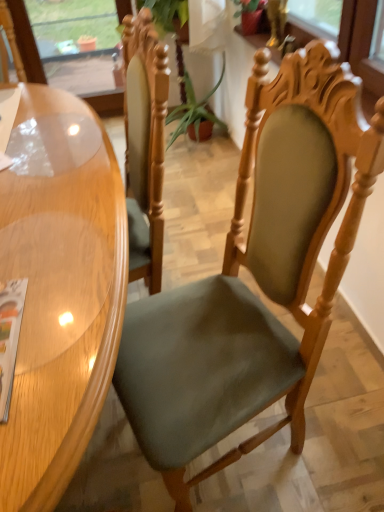
Question: Considering the relative sizes of green fabric plant at center and matte paper magazine at lower left in the image provided, is green fabric plant at center taller than matte paper magazine at lower left?

Choices:
 (A) yes
 (B) no

Answer: (A)

Question: From the image's perspective, is green fabric plant at center located beneath matte paper magazine at lower left?

Choices:
 (A) yes
 (B) no

Answer: (B)

Question: From the image's perspective, is green fabric plant at center located above matte paper magazine at lower left?

Choices:
 (A) no
 (B) yes

Answer: (B)

Question: Is green fabric plant at center closer to camera compared to matte paper magazine at lower left?

Choices:
 (A) yes
 (B) no

Answer: (B)

Question: Can you confirm if green fabric plant at center is positioned to the right of matte paper magazine at lower left?

Choices:
 (A) no
 (B) yes

Answer: (B)

Question: Is point (193, 131) closer or farther from the camera than point (331, 80)?

Choices:
 (A) closer
 (B) farther

Answer: (B)

Question: From their relative heights in the image, would you say green fabric plant at center is taller or shorter than suede green chair at center?

Choices:
 (A) tall
 (B) short

Answer: (B)

Question: In the image, is green fabric plant at center on the left side or the right side of suede green chair at center?

Choices:
 (A) right
 (B) left

Answer: (B)

Question: From a real-world perspective, relative to suede green chair at center, is green fabric plant at center vertically above or below?

Choices:
 (A) below
 (B) above

Answer: (A)

Question: From their relative heights in the image, would you say suede green chair at center is taller or shorter than green fabric plant at center?

Choices:
 (A) tall
 (B) short

Answer: (A)

Question: Is point (142, 414) closer or farther from the camera than point (185, 87)?

Choices:
 (A) farther
 (B) closer

Answer: (B)

Question: From the image's perspective, is suede green chair at center located above or below green fabric plant at center?

Choices:
 (A) below
 (B) above

Answer: (A)

Question: From a real-world perspective, is suede green chair at center above or below green fabric plant at center?

Choices:
 (A) above
 (B) below

Answer: (A)

Question: Does point (97, 401) appear closer or farther from the camera than point (382, 150)?

Choices:
 (A) closer
 (B) farther

Answer: (A)

Question: From their relative heights in the image, would you say glossy wood table at left is taller or shorter than suede green chair at center?

Choices:
 (A) tall
 (B) short

Answer: (B)